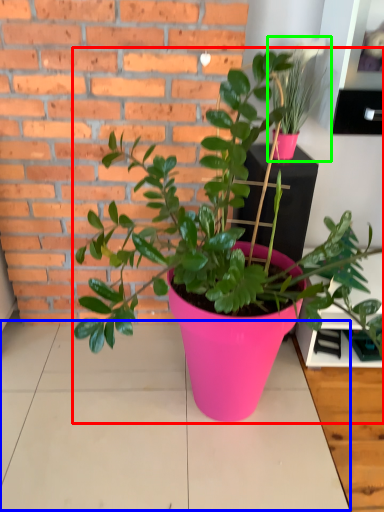
Question: Which object is the farthest from houseplant (highlighted by a red box)? Choose among these: table top (highlighted by a blue box) or houseplant (highlighted by a green box).

Choices:
 (A) table top
 (B) houseplant

Answer: (B)